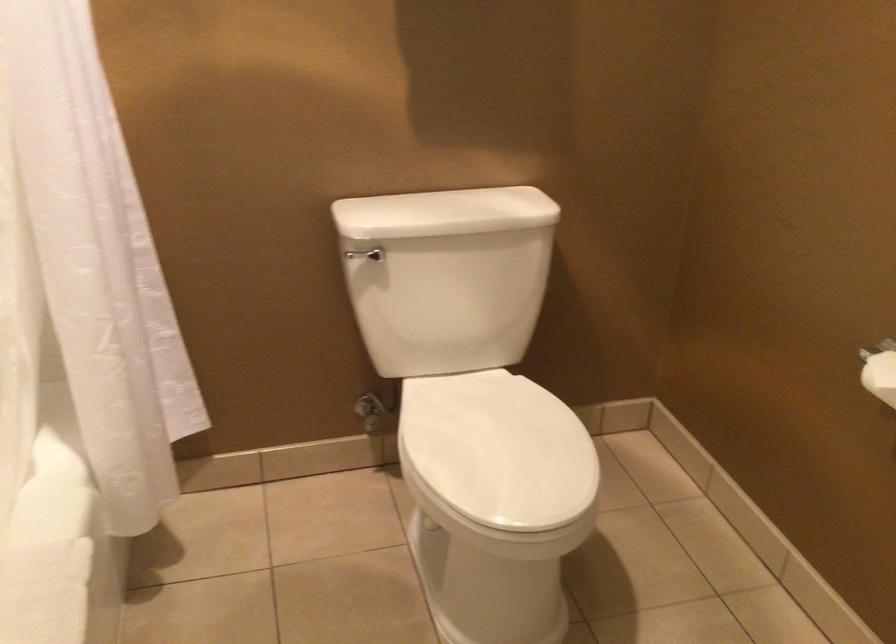
This screenshot has width=896, height=644. What do you see at coordinates (498, 450) in the screenshot?
I see `the white toilet lid` at bounding box center [498, 450].